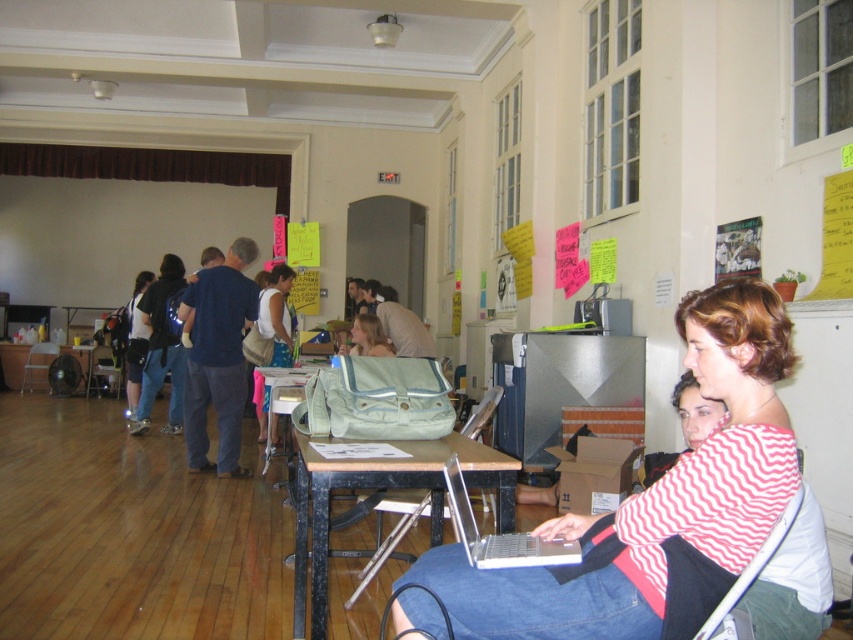
Question: Which object is positioned closest to the yellow paper at upper right?

Choices:
 (A) brown wooden table at lower left
 (B) matte black backpack at center
 (C) wooden table at center
 (D) matte blue backpack at center

Answer: (C)

Question: Does wooden table at center lie in front of metallic silver chair at left?

Choices:
 (A) no
 (B) yes

Answer: (B)

Question: Can you confirm if matte blue backpack at center is thinner than metallic silver chair at left?

Choices:
 (A) yes
 (B) no

Answer: (A)

Question: Does clear plastic laptop at lower center come behind metallic silver chair at left?

Choices:
 (A) no
 (B) yes

Answer: (A)

Question: Estimate the real-world distances between objects in this image. Which object is closer to the yellow paper at upper right?

Choices:
 (A) striped fabric shirt at center
 (B) wooden table at center

Answer: (B)

Question: Based on their relative distances, which object is farther from the striped fabric shirt at center?

Choices:
 (A) clear plastic laptop at lower center
 (B) metallic silver chair at left

Answer: (B)